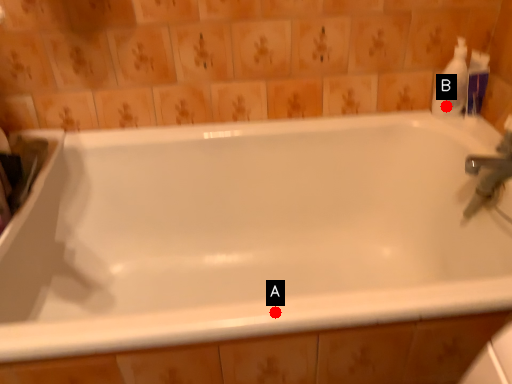
Question: Two points are circled on the image, labeled by A and B beside each circle. Which of the following is the farthest from the observer?

Choices:
 (A) A is further
 (B) B is further

Answer: (B)